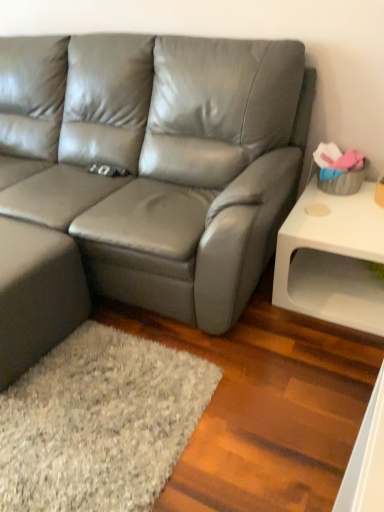
Question: From a real-world perspective, is white matte side table at right over satin gray leather couch at center?

Choices:
 (A) yes
 (B) no

Answer: (B)

Question: Can you confirm if white matte side table at right is wider than satin gray leather couch at center?

Choices:
 (A) yes
 (B) no

Answer: (B)

Question: Does white matte side table at right have a smaller size compared to satin gray leather couch at center?

Choices:
 (A) no
 (B) yes

Answer: (B)

Question: Is white matte side table at right further to camera compared to satin gray leather couch at center?

Choices:
 (A) no
 (B) yes

Answer: (B)

Question: Considering the relative sizes of white matte side table at right and satin gray leather couch at center in the image provided, is white matte side table at right bigger than satin gray leather couch at center?

Choices:
 (A) no
 (B) yes

Answer: (A)

Question: From a real-world perspective, is white matte side table at right below satin gray leather couch at center?

Choices:
 (A) yes
 (B) no

Answer: (A)

Question: Considering the relative sizes of satin gray leather couch at center and white matte side table at right in the image provided, is satin gray leather couch at center shorter than white matte side table at right?

Choices:
 (A) yes
 (B) no

Answer: (B)

Question: Is satin gray leather couch at center to the left of white matte side table at right from the viewer's perspective?

Choices:
 (A) yes
 (B) no

Answer: (A)

Question: Considering the relative sizes of satin gray leather couch at center and white matte side table at right in the image provided, is satin gray leather couch at center bigger than white matte side table at right?

Choices:
 (A) no
 (B) yes

Answer: (B)

Question: Is satin gray leather couch at center oriented towards white matte side table at right?

Choices:
 (A) no
 (B) yes

Answer: (A)

Question: Is satin gray leather couch at center directly adjacent to white matte side table at right?

Choices:
 (A) no
 (B) yes

Answer: (A)

Question: Does satin gray leather couch at center have a greater height compared to white matte side table at right?

Choices:
 (A) yes
 (B) no

Answer: (A)

Question: Considering the positions of white matte side table at right and satin gray leather couch at center in the image, is white matte side table at right wider or thinner than satin gray leather couch at center?

Choices:
 (A) wide
 (B) thin

Answer: (B)